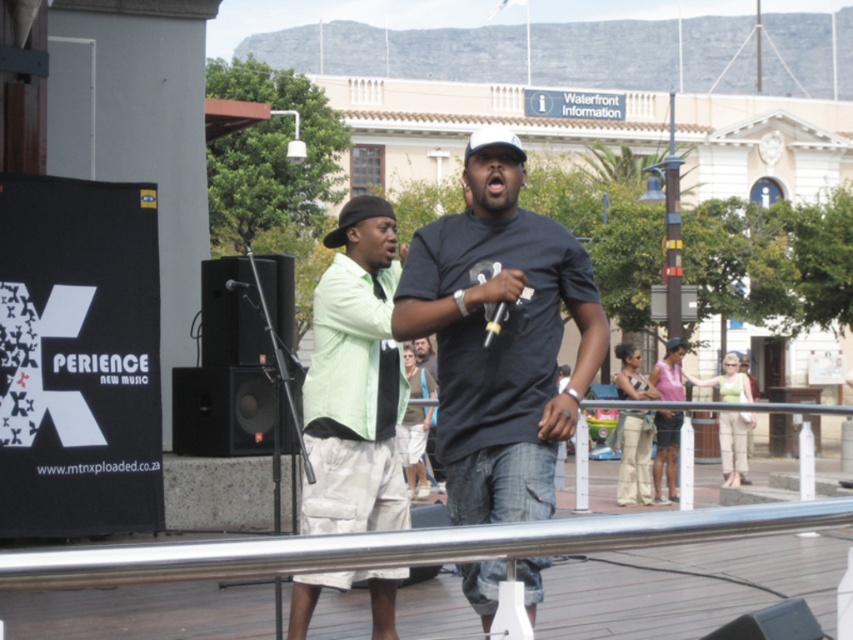
Question: Is matte black t-shirt at center positioned before black matte baseball hat at upper center?

Choices:
 (A) yes
 (B) no

Answer: (A)

Question: Which object appears closest to the camera in this image?

Choices:
 (A) black matte baseball hat at upper center
 (B) matte black t-shirt at center
 (C) light green shirt at center
 (D) polished stainless steel railing at center

Answer: (D)

Question: Which object is the closest to the matte black t-shirt at center?

Choices:
 (A) black matte baseball hat at upper center
 (B) black matte microphone at center

Answer: (A)

Question: Does matte black t-shirt at center have a smaller size compared to black matte microphone at center?

Choices:
 (A) no
 (B) yes

Answer: (A)

Question: Which object is positioned closest to the matte black t-shirt at center?

Choices:
 (A) black matte baseball hat at upper center
 (B) black matte microphone at center

Answer: (A)

Question: Can you confirm if matte black t-shirt at center is positioned to the right of black matte microphone at center?

Choices:
 (A) yes
 (B) no

Answer: (A)